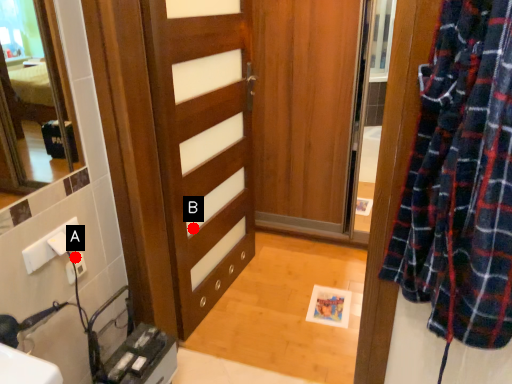
Question: Two points are circled on the image, labeled by A and B beside each circle. Which point is closer to the camera?

Choices:
 (A) A is closer
 (B) B is closer

Answer: (A)